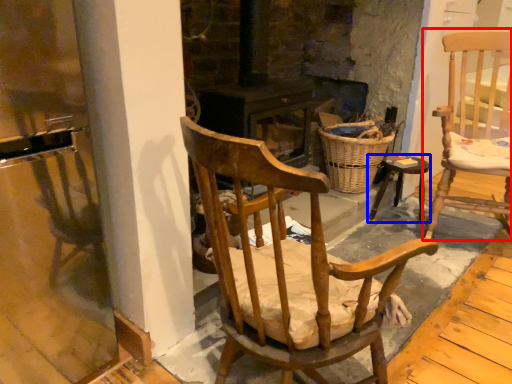
Question: Which object is further to the camera taking this photo, chair (highlighted by a red box) or stool (highlighted by a blue box)?

Choices:
 (A) chair
 (B) stool

Answer: (B)